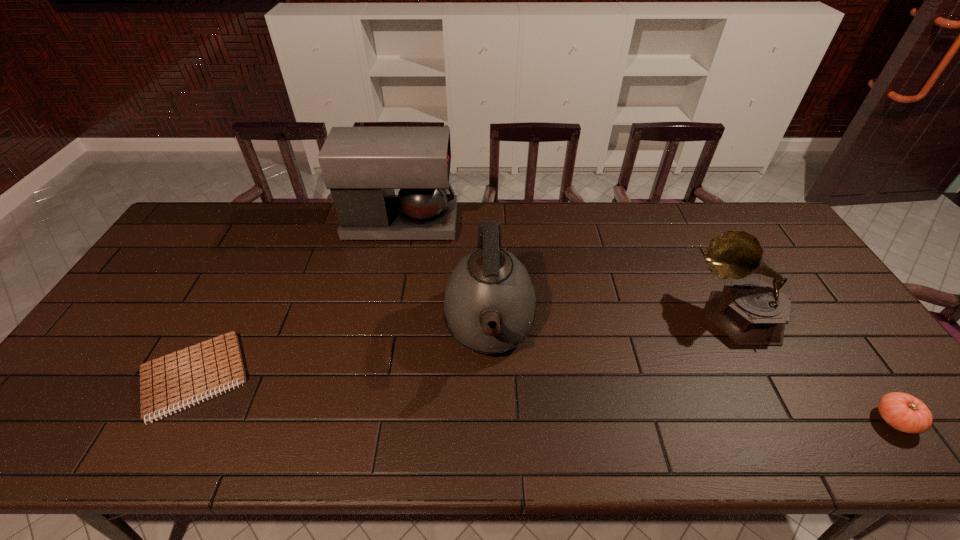
Find the location of `free point that satisfies the following two spatial constraints: 1. at the spout of the kettle; 2. on the right side of the tomato`. free point that satisfies the following two spatial constraints: 1. at the spout of the kettle; 2. on the right side of the tomato is located at coordinates (492, 420).